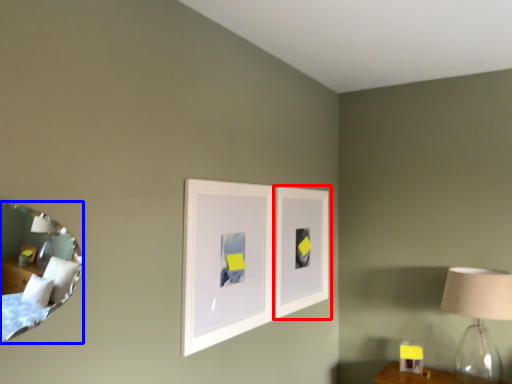
Question: Among these objects, which one is farthest to the camera, picture frame (highlighted by a red box) or mirror (highlighted by a blue box)?

Choices:
 (A) picture frame
 (B) mirror

Answer: (A)